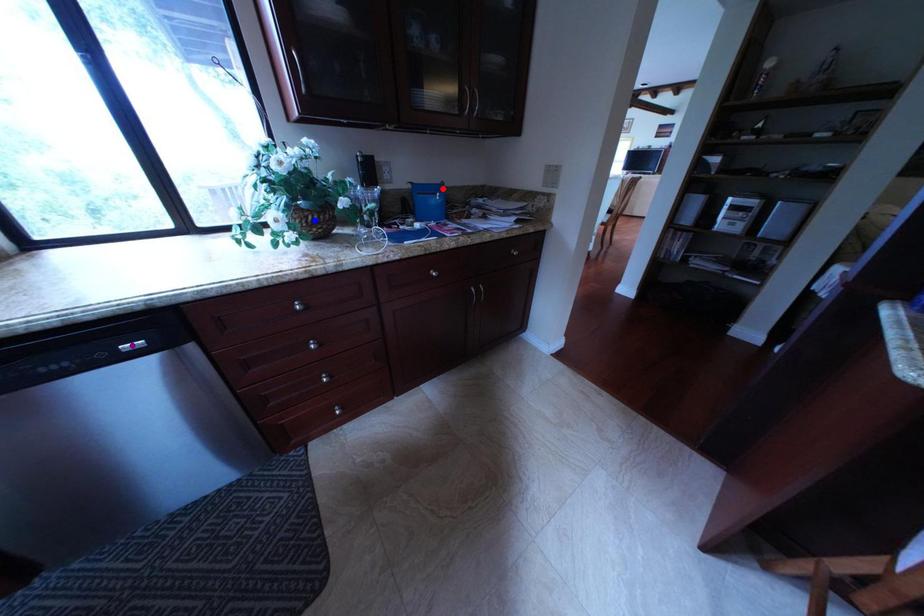
Order these from nearest to farthest:
blue point, purple point, red point

purple point
blue point
red point